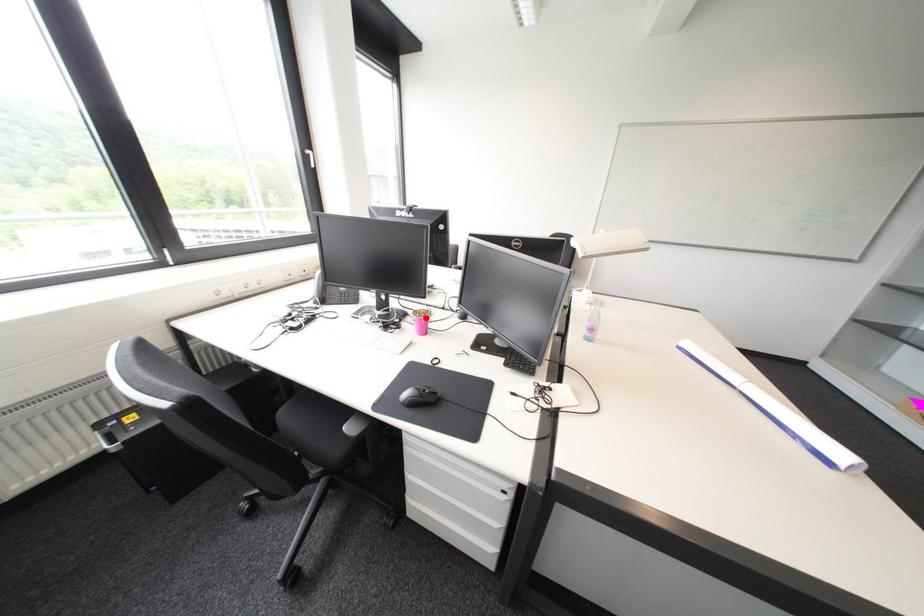
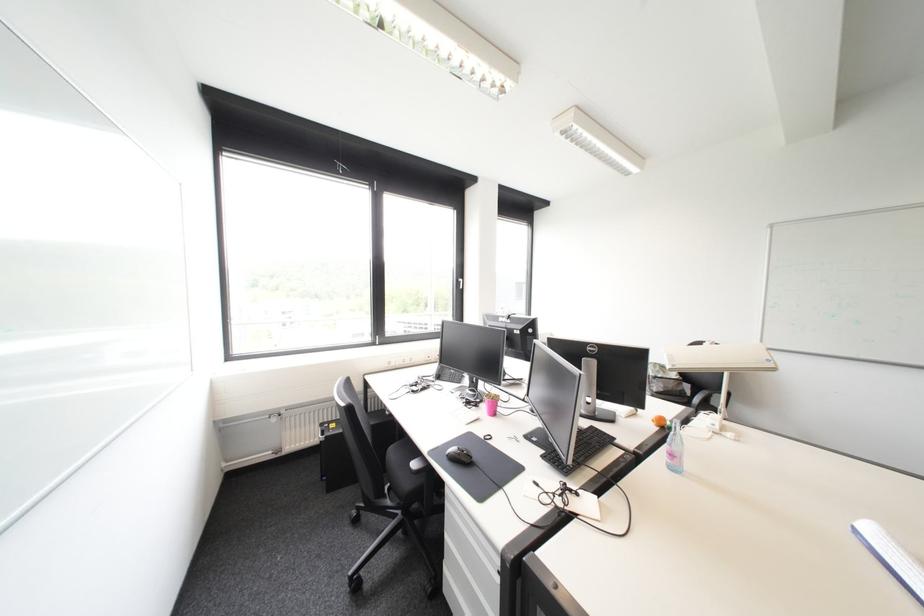
The point at the highlighted location is marked in the first image. Where is the corresponding point in the second image?

(495, 400)